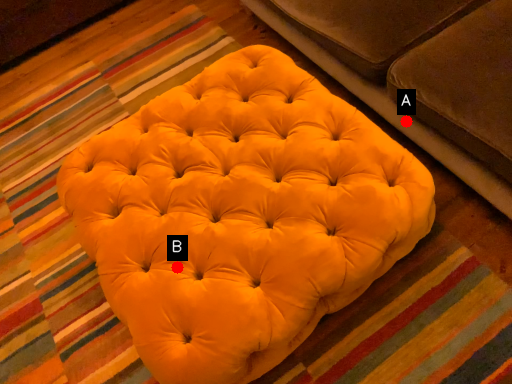
Question: Two points are circled on the image, labeled by A and B beside each circle. Which point is closer to the camera?

Choices:
 (A) A is closer
 (B) B is closer

Answer: (B)